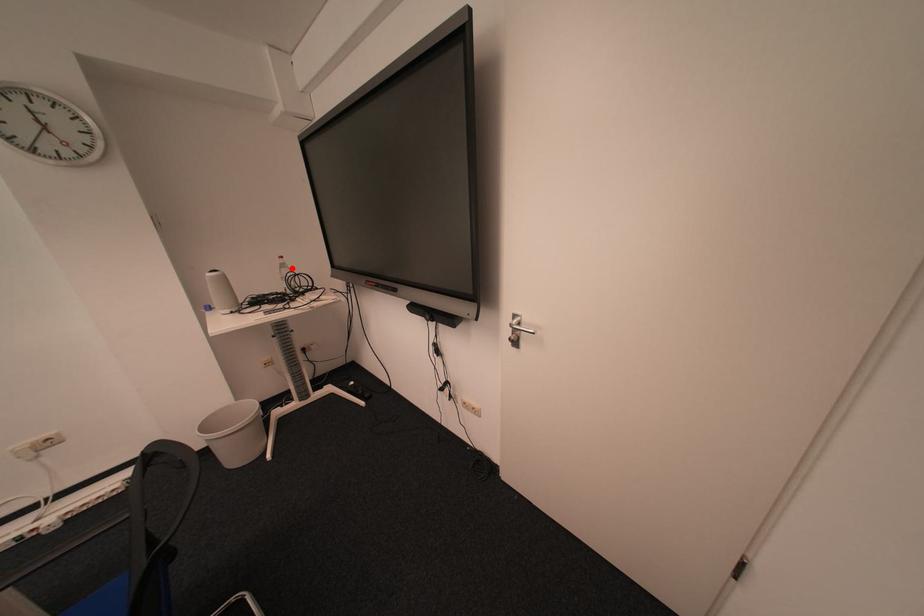
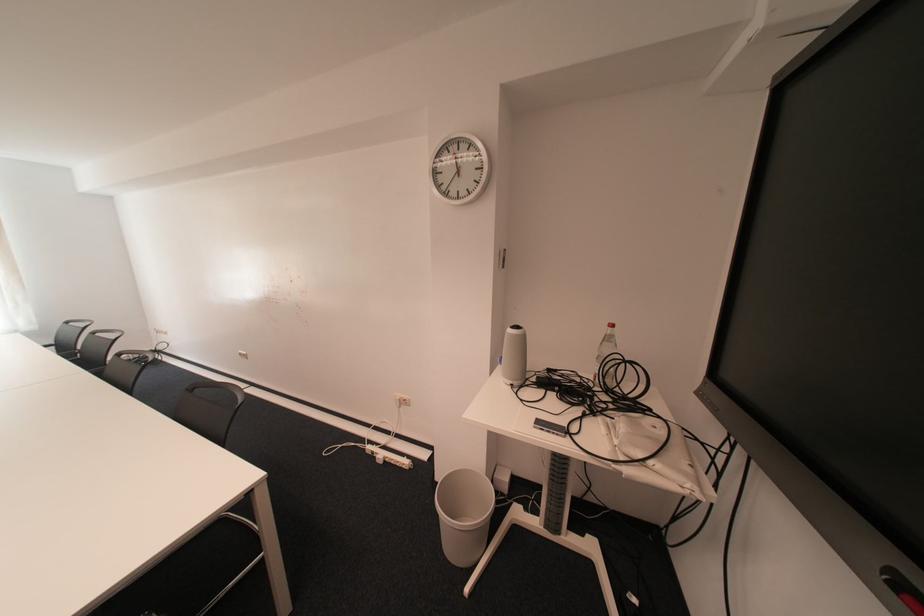
The point at the highlighted location is marked in the first image. Where is the corresponding point in the second image?

(614, 341)